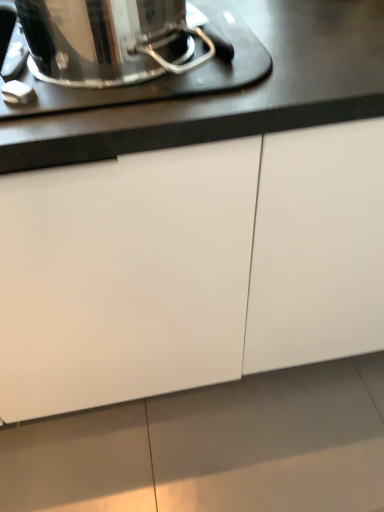
What are the coordinates of `vacant area that lies to the right of polished stainless steel pot at upper left` in the screenshot? It's located at (286, 47).